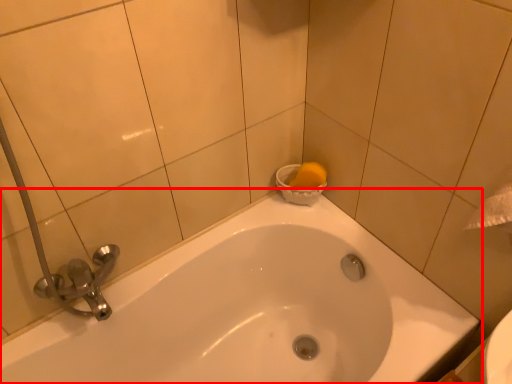
Question: Considering the relative positions of bathtub (annotated by the red box) and basin in the image provided, where is bathtub (annotated by the red box) located with respect to the staircase?

Choices:
 (A) right
 (B) left

Answer: (B)